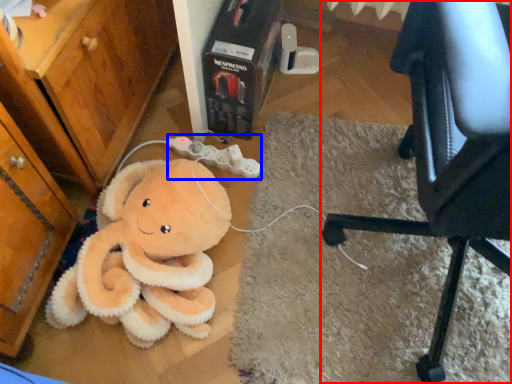
Question: Among these objects, which one is nearest to the camera, chair (highlighted by a red box) or game controller (highlighted by a blue box)?

Choices:
 (A) chair
 (B) game controller

Answer: (A)